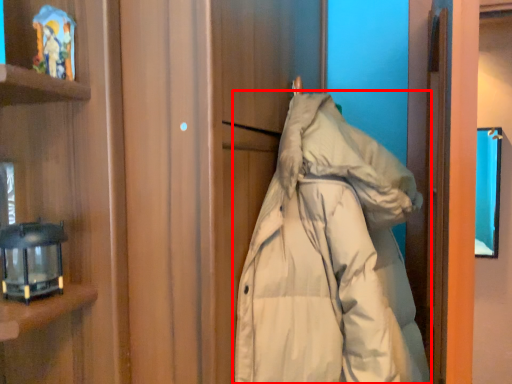
Question: From the image's perspective, what is the correct spatial positioning of jacket (annotated by the red box) in reference to lamp?

Choices:
 (A) above
 (B) below

Answer: (B)